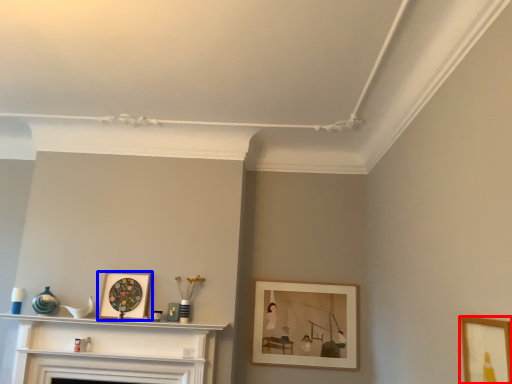
Question: Which of the following is the farthest to the observer, picture frame (highlighted by a red box) or picture frame (highlighted by a blue box)?

Choices:
 (A) picture frame
 (B) picture frame

Answer: (B)